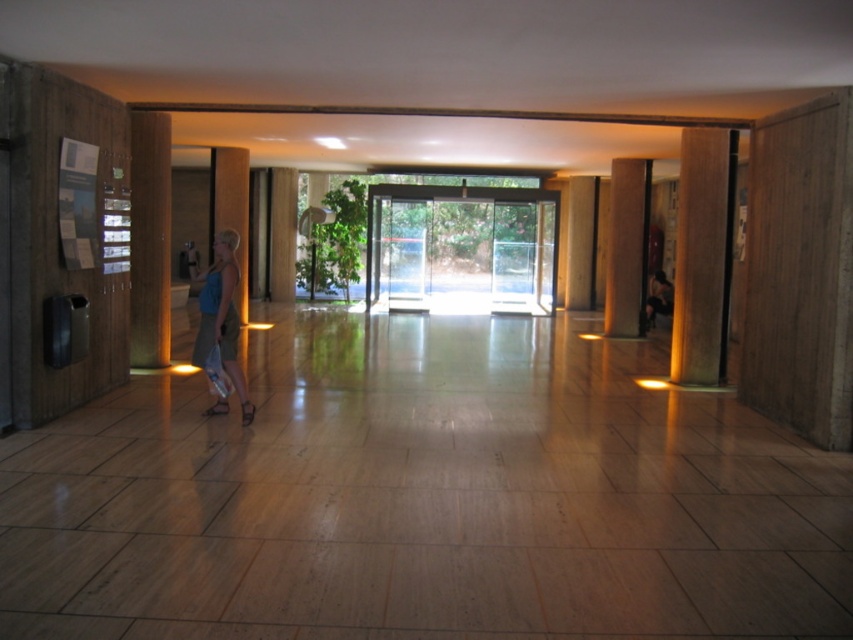
Question: Which of the following is the farthest from the observer?

Choices:
 (A) brown polished wood pillar at center
 (B) matte blue dress at center

Answer: (A)

Question: From the image, what is the correct spatial relationship of brown polished wood pillar at right in relation to brown polished wood pillar at center?

Choices:
 (A) above
 (B) below

Answer: (B)

Question: Among these points, which one is farthest from the camera?

Choices:
 (A) click(x=643, y=234)
 (B) click(x=236, y=221)
 (C) click(x=225, y=291)
 (D) click(x=700, y=193)

Answer: (B)

Question: Is matte blue dress at center above matte concrete pillar at center?

Choices:
 (A) no
 (B) yes

Answer: (A)

Question: Does brown polished wood pillar at right have a greater width compared to matte concrete pillar at center?

Choices:
 (A) yes
 (B) no

Answer: (B)

Question: Which point is closer to the camera?

Choices:
 (A) transparent glass door at center
 (B) brown polished wood pillar at right
 (C) brown polished wood pillar at center
 (D) matte concrete pillar at center

Answer: (B)